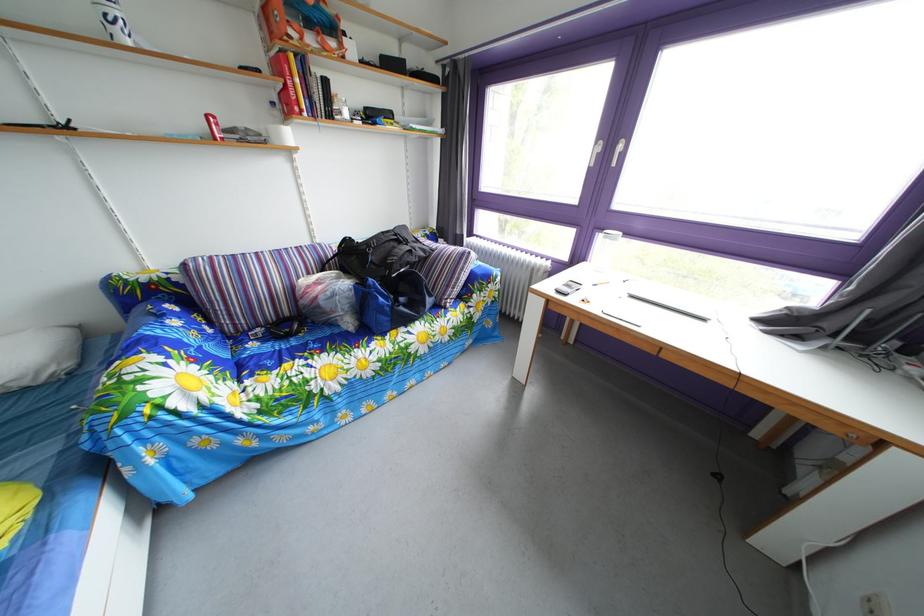
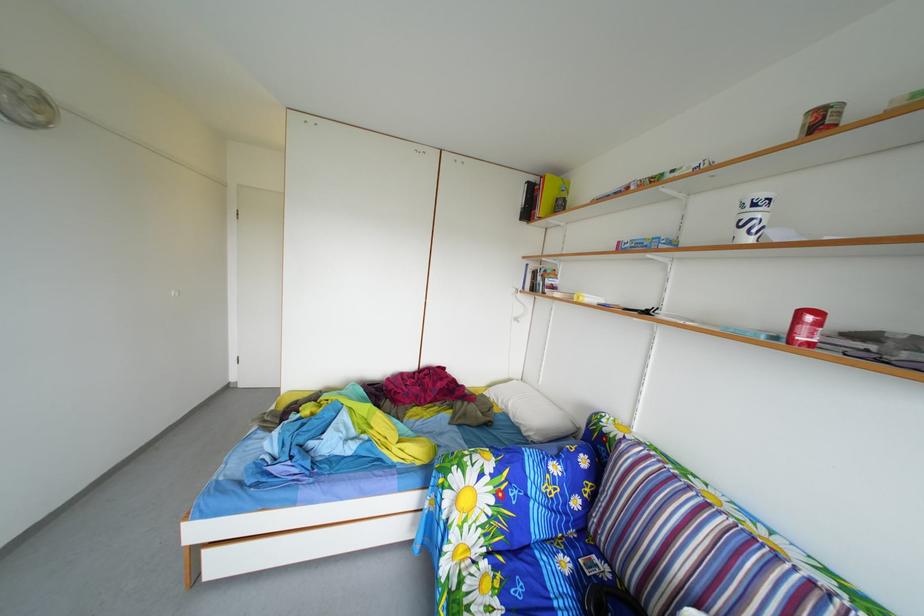
Where in the second image is the point corresponding to point 217,124 from the first image?

(811, 321)